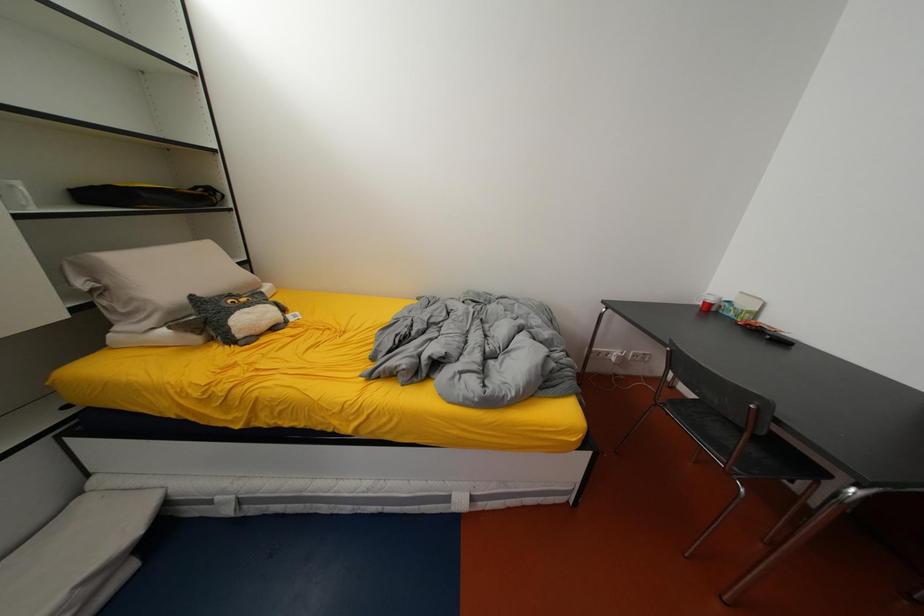
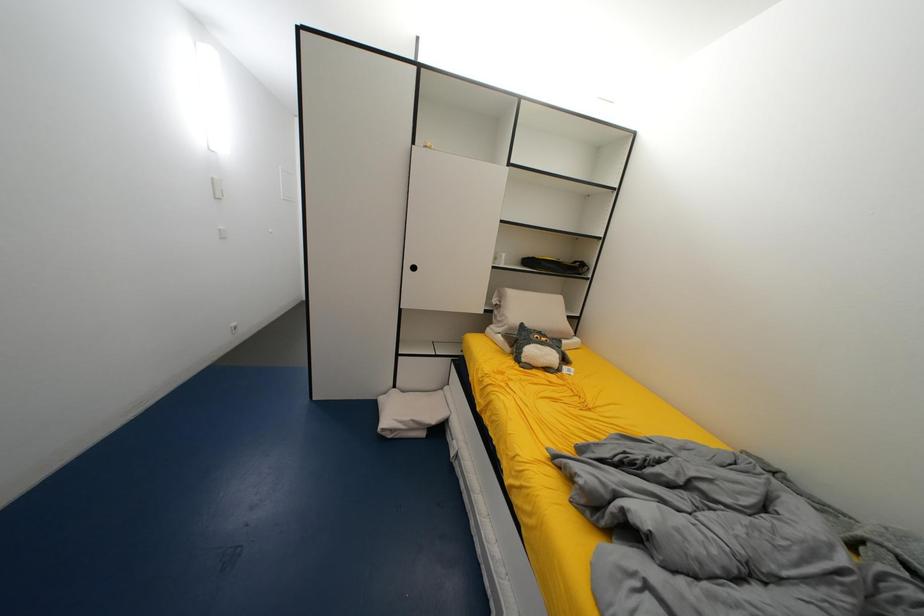
Question: The camera is either moving clockwise (left) or counter-clockwise (right) around the object. The first image is from the beginning of the video and the second image is from the end. Is the camera moving left or right when shooting the video?

Choices:
 (A) Left
 (B) Right

Answer: (B)